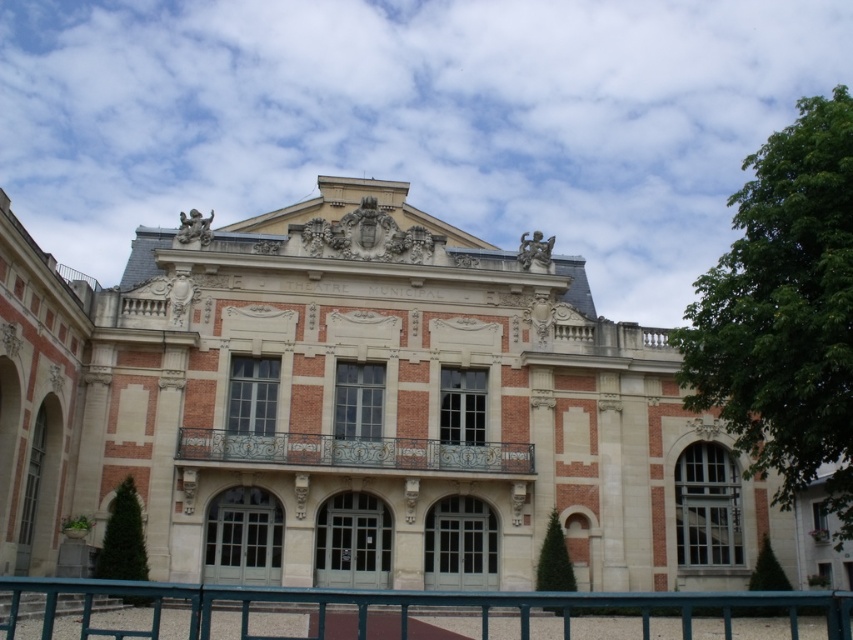
You are an architect evaluating the Theatre Municipal building. You notice the brick building at center and the teal metal fence at lower center. Which object is taller?

The brick building at center is taller than the teal metal fence at lower center.

Looking at this image, you are a city planner assessing the Theatre Municipal building. You need to determine which object, the teal metal fence at lower center or the wrought iron balcony at center, would require more materials for a full restoration. Based on the scene, which one would need more resources?

The teal metal fence at lower center requires more materials for restoration because it has a larger size compared to the wrought iron balcony at center.